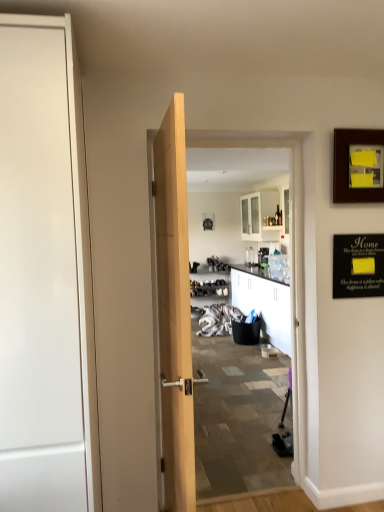
The width and height of the screenshot is (384, 512). Describe the element at coordinates (357, 166) in the screenshot. I see `wooden picture frame at upper right, the second picture frame positioned from the left` at that location.

The width and height of the screenshot is (384, 512). Identify the location of wooden picture frame at center, placed as the 1th picture frame when sorted from left to right. (208, 221).

Image resolution: width=384 pixels, height=512 pixels. Identify the location of wooden picture frame at upper right, placed as the 1th picture frame when sorted from right to left. (357, 166).

From a real-world perspective, is white glossy door at left above or below wooden picture frame at upper right, the second picture frame positioned from the left?

white glossy door at left is below wooden picture frame at upper right, the second picture frame positioned from the left.

Does white glossy door at left have a lesser width compared to wooden picture frame at upper right, the second picture frame positioned from the left?

Incorrect, the width of white glossy door at left is not less than that of wooden picture frame at upper right, the second picture frame positioned from the left.

How distant is white glossy door at left from wooden picture frame at upper right, the second picture frame when ordered from back to front?

A distance of 5.18 feet exists between white glossy door at left and wooden picture frame at upper right, the second picture frame when ordered from back to front.

Considering the relative sizes of white glossy door at left and wooden picture frame at upper right, the first picture frame in the front-to-back sequence, in the image provided, is white glossy door at left smaller than wooden picture frame at upper right, the first picture frame in the front-to-back sequence,?

No.

Considering the sizes of black matte bulletin board at upper right and wooden picture frame at upper right, the second picture frame positioned from the left, in the image, is black matte bulletin board at upper right taller or shorter than wooden picture frame at upper right, the second picture frame positioned from the left,?

Clearly, black matte bulletin board at upper right is shorter compared to wooden picture frame at upper right, the second picture frame positioned from the left.

From a real-world perspective, which is physically below, black matte bulletin board at upper right or wooden picture frame at upper right, the second picture frame positioned from the left?

From a 3D spatial view, black matte bulletin board at upper right is below.

Is black matte bulletin board at upper right situated inside wooden picture frame at upper right, the second picture frame when ordered from back to front, or outside?

black matte bulletin board at upper right is outside wooden picture frame at upper right, the second picture frame when ordered from back to front.

Can you tell me how much wooden picture frame at center, placed as the 1th picture frame when sorted from left to right, and white glossy door at left differ in facing direction?

The facing directions of wooden picture frame at center, placed as the 1th picture frame when sorted from left to right, and white glossy door at left are 0.855 degrees apart.

Which of these two, wooden picture frame at center, placed as the 1th picture frame when sorted from left to right, or white glossy door at left, stands shorter?

With less height is wooden picture frame at center, placed as the 1th picture frame when sorted from left to right.

How much distance is there between wooden picture frame at center, acting as the 1th picture frame starting from the back, and white glossy door at left?

The distance of wooden picture frame at center, acting as the 1th picture frame starting from the back, from white glossy door at left is 6.63 meters.

Is wooden picture frame at center, the 2th picture frame from the front, not close to white glossy door at left?

wooden picture frame at center, the 2th picture frame from the front, is positioned a significant distance from white glossy door at left.

Is white glossy door at left positioned with its back to wooden picture frame at center, placed as the 1th picture frame when sorted from left to right?

No, wooden picture frame at center, placed as the 1th picture frame when sorted from left to right, is not at the back of white glossy door at left.

Which point is more forward, (73, 261) or (210, 227)?

The point (73, 261) is closer to the camera.

Considering the relative sizes of white glossy door at left and wooden picture frame at center, acting as the 1th picture frame starting from the back, in the image provided, is white glossy door at left shorter than wooden picture frame at center, acting as the 1th picture frame starting from the back,?

No.

Is white glossy door at left to the right of wooden picture frame at center, acting as the 2th picture frame starting from the right, from the viewer's perspective?

In fact, white glossy door at left is to the left of wooden picture frame at center, acting as the 2th picture frame starting from the right.

Is wooden picture frame at upper right, the first picture frame in the front-to-back sequence, at the left side of black matte bulletin board at upper right?

Yes.

Is wooden picture frame at upper right, placed as the 1th picture frame when sorted from right to left, not near black matte bulletin board at upper right?

No, wooden picture frame at upper right, placed as the 1th picture frame when sorted from right to left, is not far from black matte bulletin board at upper right.

Is wooden picture frame at upper right, placed as the 1th picture frame when sorted from right to left, smaller than black matte bulletin board at upper right?

No, wooden picture frame at upper right, placed as the 1th picture frame when sorted from right to left, is not smaller than black matte bulletin board at upper right.

From the image's perspective, which one is positioned higher, wooden picture frame at upper right, the second picture frame positioned from the left, or black matte bulletin board at upper right?

wooden picture frame at upper right, the second picture frame positioned from the left, from the image's perspective.

Does white glossy door at left appear on the left side of black matte bulletin board at upper right?

Indeed, white glossy door at left is positioned on the left side of black matte bulletin board at upper right.

I want to click on door below the black matte bulletin board at upper right (from the image's perspective), so click(38, 279).

What's the angular difference between white glossy door at left and black matte bulletin board at upper right's facing directions?

There is a 0.211-degree angle between the facing directions of white glossy door at left and black matte bulletin board at upper right.

From the image's perspective, which is above, white glossy door at left or black matte bulletin board at upper right?

black matte bulletin board at upper right appears higher in the image.

Considering the sizes of wooden picture frame at center, acting as the 2th picture frame starting from the right, and black matte bulletin board at upper right in the image, is wooden picture frame at center, acting as the 2th picture frame starting from the right, wider or thinner than black matte bulletin board at upper right?

In the image, wooden picture frame at center, acting as the 2th picture frame starting from the right, appears to be wider than black matte bulletin board at upper right.

Does point (212, 219) come farther from viewer compared to point (368, 288)?

Yes.

Is wooden picture frame at center, acting as the 1th picture frame starting from the back, not close to black matte bulletin board at upper right?

Yes, wooden picture frame at center, acting as the 1th picture frame starting from the back, and black matte bulletin board at upper right are located far from each other.

Could you tell me if wooden picture frame at center, acting as the 1th picture frame starting from the back, is turned towards black matte bulletin board at upper right?

Yes.

You are a GUI agent. You are given a task and a screenshot of the screen. Output one action in this format:
    pyautogui.click(x=<x>, y=<y>)
    Task: Click on the picture frame that is the 1st object located above the white glossy door at left (from the image's perspective)
    The height and width of the screenshot is (512, 384).
    Given the screenshot: What is the action you would take?
    357,166

You are a GUI agent. You are given a task and a screenshot of the screen. Output one action in this format:
    pyautogui.click(x=<x>, y=<y>)
    Task: Click on the bulletin board on the right of wooden picture frame at upper right, the second picture frame positioned from the left
    
    Given the screenshot: What is the action you would take?
    pyautogui.click(x=358, y=266)

Looking at the image, which one is located closer to white glossy door at left, black matte bulletin board at upper right or wooden picture frame at upper right, the second picture frame positioned from the left?

The object closer to white glossy door at left is black matte bulletin board at upper right.

When comparing their distances from black matte bulletin board at upper right, does white glossy door at left or wooden picture frame at upper right, placed as the 1th picture frame when sorted from right to left, seem closer?

wooden picture frame at upper right, placed as the 1th picture frame when sorted from right to left.

Estimate the real-world distances between objects in this image. Which object is closer to black matte bulletin board at upper right, white glossy door at left or wooden picture frame at center, acting as the 2th picture frame starting from the right?

The object closer to black matte bulletin board at upper right is white glossy door at left.

From the image, which object appears to be farther from black matte bulletin board at upper right, wooden picture frame at upper right, placed as the 1th picture frame when sorted from right to left, or wooden picture frame at center, acting as the 1th picture frame starting from the back?

wooden picture frame at center, acting as the 1th picture frame starting from the back, lies further to black matte bulletin board at upper right than the other object.

When comparing their distances from wooden picture frame at upper right, the first picture frame in the front-to-back sequence, does black matte bulletin board at upper right or white glossy door at left seem further?

white glossy door at left lies further to wooden picture frame at upper right, the first picture frame in the front-to-back sequence, than the other object.

Based on their spatial positions, is white glossy door at left or wooden picture frame at center, the 2th picture frame from the front, further from wooden picture frame at upper right, the second picture frame when ordered from back to front?

wooden picture frame at center, the 2th picture frame from the front, lies further to wooden picture frame at upper right, the second picture frame when ordered from back to front, than the other object.

Based on their spatial positions, is wooden picture frame at upper right, placed as the 1th picture frame when sorted from right to left, or white glossy door at left closer to wooden picture frame at center, acting as the 1th picture frame starting from the back?

Among the two, wooden picture frame at upper right, placed as the 1th picture frame when sorted from right to left, is located nearer to wooden picture frame at center, acting as the 1th picture frame starting from the back.

From the image, which object appears to be nearer to wooden picture frame at center, placed as the 1th picture frame when sorted from left to right, wooden picture frame at upper right, the first picture frame in the front-to-back sequence, or black matte bulletin board at upper right?

black matte bulletin board at upper right is closer to wooden picture frame at center, placed as the 1th picture frame when sorted from left to right.

At what (x,y) coordinates should I click in order to perform the action: click on picture frame located between white glossy door at left and wooden picture frame at center, placed as the 1th picture frame when sorted from left to right, in the depth direction. Please return your answer as a coordinate pair (x, y). Image resolution: width=384 pixels, height=512 pixels. Looking at the image, I should click on [357, 166].

At what (x,y) coordinates should I click in order to perform the action: click on bulletin board between wooden picture frame at upper right, the second picture frame positioned from the left, and wooden picture frame at center, acting as the 1th picture frame starting from the back, in the front-back direction. Please return your answer as a coordinate pair (x, y). This screenshot has height=512, width=384. Looking at the image, I should click on (358, 266).

The image size is (384, 512). Find the location of `bulletin board between white glossy door at left and wooden picture frame at center, acting as the 2th picture frame starting from the right, in the front-back direction`. bulletin board between white glossy door at left and wooden picture frame at center, acting as the 2th picture frame starting from the right, in the front-back direction is located at coordinates (358, 266).